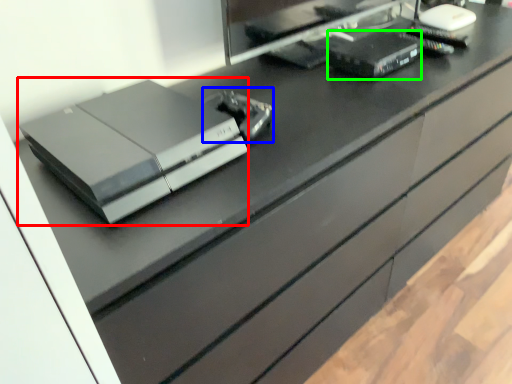
Question: Considering the real-world distances, which object is farthest from printer (highlighted by a red box)? equipment (highlighted by a blue box) or equipment (highlighted by a green box)?

Choices:
 (A) equipment
 (B) equipment

Answer: (B)